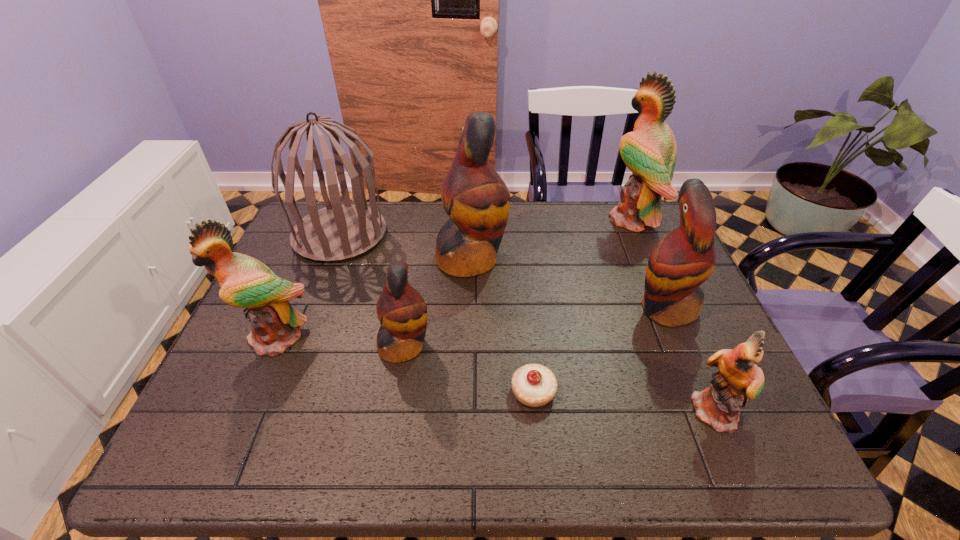
Point out which red parrot is positioned as the second nearest to the leftmost green parrot. Please provide its 2D coordinates. Your answer should be formatted as a tuple, i.e. [(x, y)], where the tuple contains the x and y coordinates of a point satisfying the conditions above.

[(476, 199)]

Select which red parrot is the closest to the beige pastry. Please provide its 2D coordinates. Your answer should be formatted as a tuple, i.e. [(x, y)], where the tuple contains the x and y coordinates of a point satisfying the conditions above.

[(402, 312)]

This screenshot has height=540, width=960. What are the coordinates of `vacant space that satisfies the following two spatial constraints: 1. on the front-facing side of the biggest green parrot; 2. on the front-facing side of the second biggest green parrot` in the screenshot? It's located at (684, 337).

Locate an element on the screen. This screenshot has width=960, height=540. vacant position in the image that satisfies the following two spatial constraints: 1. on the front-facing side of the beige pastry; 2. on the right side of the second farthest green parrot is located at coordinates (253, 392).

You are a GUI agent. You are given a task and a screenshot of the screen. Output one action in this format:
    pyautogui.click(x=<x>, y=<y>)
    Task: Click on the free region that satisfies the following two spatial constraints: 1. on the face of the shortest object; 2. on the right side of the smallest red parrot
    This screenshot has width=960, height=540.
    Given the screenshot: What is the action you would take?
    pyautogui.click(x=397, y=392)